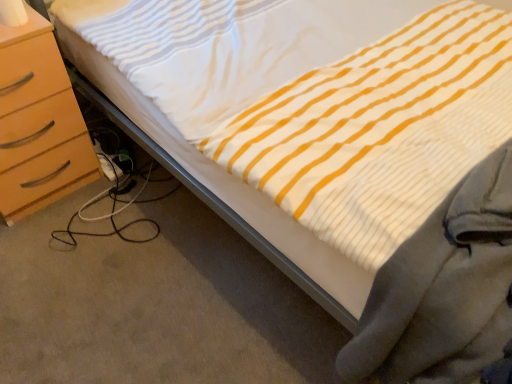
Consider the image. Measure the distance between matte wood chest of drawers at left and camera.

1.18 meters.

This screenshot has width=512, height=384. Identify the location of matte wood chest of drawers at left. (38, 123).

Describe the element at coordinates (38, 123) in the screenshot. This screenshot has width=512, height=384. I see `matte wood chest of drawers at left` at that location.

Locate an element on the screen. matte wood chest of drawers at left is located at coordinates (38, 123).